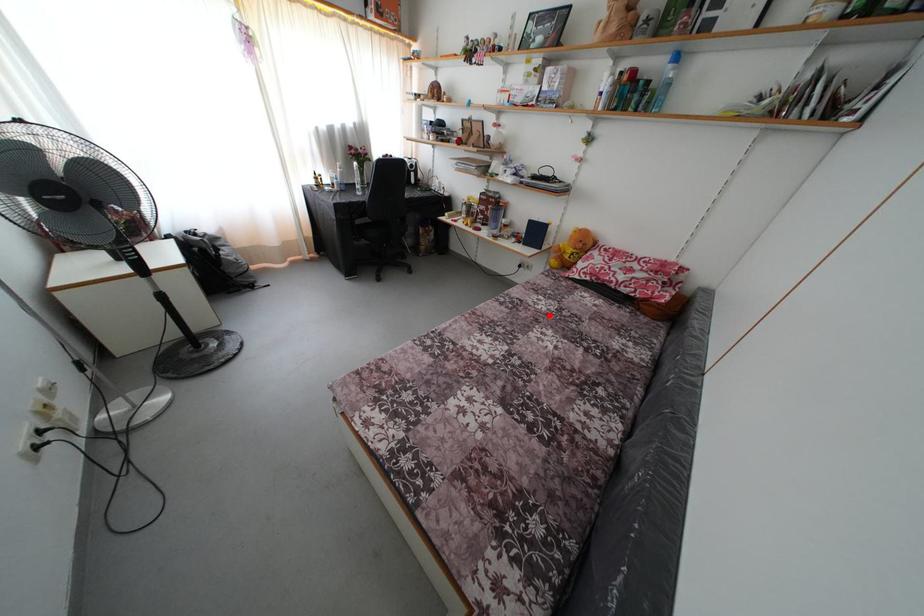
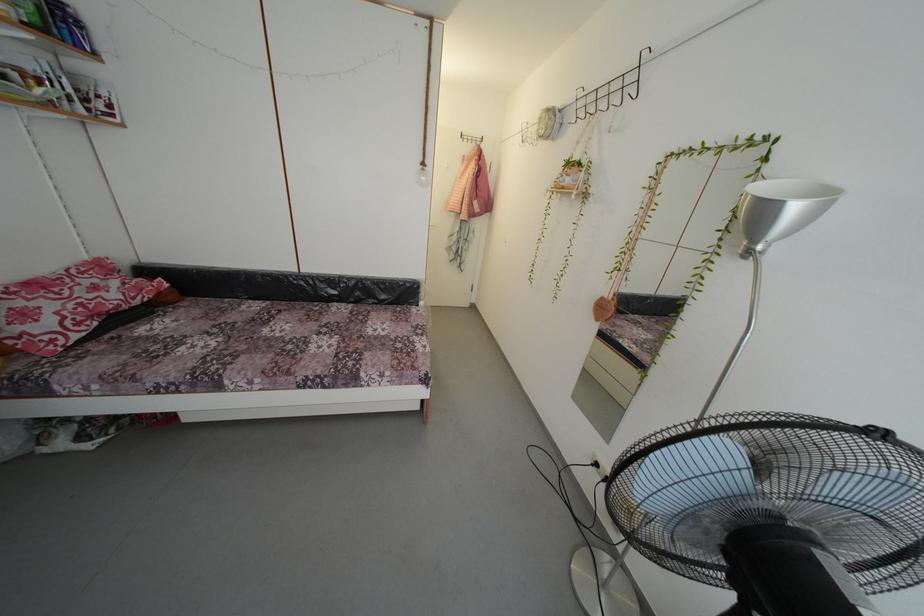
Locate, in the second image, the point that corresponds to the highlighted location in the first image.

(225, 345)